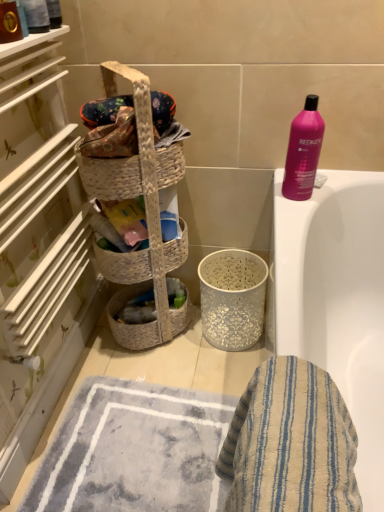
Describe the element at coordinates (146, 218) in the screenshot. I see `woven beige laundry basket at left` at that location.

Locate an element on the screen. blue striped cloth at lower right is located at coordinates (290, 443).

Measure the distance between point (154,161) and camera.

The depth of point (154,161) is 3.71 feet.

You are a GUI agent. You are given a task and a screenshot of the screen. Output one action in this format:
    pyautogui.click(x=<x>, y=<y>)
    Task: Click on the woven basket at left
    The height and width of the screenshot is (512, 384).
    Given the screenshot: What is the action you would take?
    pyautogui.click(x=39, y=249)

Where is `woven beige laundry basket at left`? woven beige laundry basket at left is located at coordinates (146, 218).

From their relative heights in the image, would you say woven basket at left is taller or shorter than gray textured bath mat at lower center?

woven basket at left is taller than gray textured bath mat at lower center.

From the image's perspective, which is above, woven basket at left or gray textured bath mat at lower center?

woven basket at left.

At what (x,y) coordinates should I click in order to perform the action: click on shelf lying above the gray textured bath mat at lower center (from the image's perspective). Please return your answer as a coordinate pair (x, y). Looking at the image, I should click on pyautogui.click(x=39, y=249).

From a real-world perspective, which object stands above the other?

From a 3D spatial view, woven basket at left is above.

Is point (114, 457) positioned in front of point (81, 341)?

Yes, point (114, 457) is in front of point (81, 341).

This screenshot has width=384, height=512. I want to click on shelf that appears in front of the gray textured bath mat at lower center, so click(x=39, y=249).

How different are the orientations of gray textured bath mat at lower center and woven basket at left in degrees?

The angle between the facing direction of gray textured bath mat at lower center and the facing direction of woven basket at left is 90.5 degrees.

Can you confirm if woven natural picnic basket at center is shorter than gray textured bath mat at lower center?

In fact, woven natural picnic basket at center may be taller than gray textured bath mat at lower center.

From the image's perspective, is woven natural picnic basket at center located above or below gray textured bath mat at lower center?

From the image's perspective, woven natural picnic basket at center appears above gray textured bath mat at lower center.

In the image, there is a woven natural picnic basket at center. At what (x,y) coordinates should I click in order to perform the action: click on bath mat below it (from the image's perspective). Please return your answer as a coordinate pair (x, y). The image size is (384, 512). Looking at the image, I should click on (135, 451).

Between woven natural picnic basket at center and gray textured bath mat at lower center, which one has larger width?

gray textured bath mat at lower center.

In terms of size, does pink glossy shampoo at upper right appear bigger or smaller than woven basket at left?

Clearly, pink glossy shampoo at upper right is smaller in size than woven basket at left.

Is pink glossy shampoo at upper right placed right next to woven basket at left?

pink glossy shampoo at upper right and woven basket at left are clearly separated.

Is pink glossy shampoo at upper right completely or partially outside of woven basket at left?

Yes, pink glossy shampoo at upper right is located beyond the bounds of woven basket at left.

Are woven beige laundry basket at left and gray textured bath mat at lower center located far from each other?

Actually, woven beige laundry basket at left and gray textured bath mat at lower center are a little close together.

Is woven beige laundry basket at left bigger than gray textured bath mat at lower center?

Indeed, woven beige laundry basket at left has a larger size compared to gray textured bath mat at lower center.

Would you say gray textured bath mat at lower center is part of woven beige laundry basket at left's contents?

No, gray textured bath mat at lower center is located outside of woven beige laundry basket at left.

Is point (150, 126) positioned after point (108, 471)?

No, (150, 126) is closer to viewer.

Is gray textured bath mat at lower center far away from pink glossy shampoo at upper right?

No.

Considering the relative sizes of gray textured bath mat at lower center and pink glossy shampoo at upper right in the image provided, is gray textured bath mat at lower center thinner than pink glossy shampoo at upper right?

No, gray textured bath mat at lower center is not thinner than pink glossy shampoo at upper right.

Is gray textured bath mat at lower center facing away from pink glossy shampoo at upper right?

No, pink glossy shampoo at upper right is not at the back of gray textured bath mat at lower center.

Are woven beige laundry basket at left and blue striped cloth at lower right located far from each other?

No.

Is woven beige laundry basket at left positioned in front of blue striped cloth at lower right?

No, it is behind blue striped cloth at lower right.

Where is `laundry basket behind the blue striped cloth at lower right`? This screenshot has width=384, height=512. laundry basket behind the blue striped cloth at lower right is located at coordinates (146, 218).

I want to click on bath mat located behind the woven basket at left, so click(135, 451).

Where is `shelf to the left of gray textured bath mat at lower center`? This screenshot has height=512, width=384. shelf to the left of gray textured bath mat at lower center is located at coordinates (39, 249).

Estimate the real-world distances between objects in this image. Which object is closer to gray textured bath mat at lower center, woven basket at left or blue striped cloth at lower right?

woven basket at left is positioned closer to the anchor gray textured bath mat at lower center.

Which object lies nearer to the anchor point woven natural picnic basket at center, gray textured bath mat at lower center or blue striped cloth at lower right?

gray textured bath mat at lower center lies closer to woven natural picnic basket at center than the other object.

When comparing their distances from gray textured bath mat at lower center, does pink glossy shampoo at upper right or woven beige laundry basket at left seem closer?

woven beige laundry basket at left is closer to gray textured bath mat at lower center.

Based on their spatial positions, is blue striped cloth at lower right or woven basket at left further from woven beige laundry basket at left?

Based on the image, blue striped cloth at lower right appears to be further to woven beige laundry basket at left.

From the image, which object appears to be farther from woven basket at left, woven beige laundry basket at left or pink glossy shampoo at upper right?

pink glossy shampoo at upper right.

When comparing their distances from woven basket at left, does woven natural picnic basket at center or blue striped cloth at lower right seem further?

blue striped cloth at lower right.

Estimate the real-world distances between objects in this image. Which object is closer to woven natural picnic basket at center, pink glossy shampoo at upper right or woven basket at left?

Based on the image, woven basket at left appears to be nearer to woven natural picnic basket at center.

Considering their positions, is woven beige laundry basket at left positioned closer to woven natural picnic basket at center than pink glossy shampoo at upper right?

The object closer to woven natural picnic basket at center is woven beige laundry basket at left.

This screenshot has height=512, width=384. I want to click on laundry basket between woven basket at left and pink glossy shampoo at upper right in the horizontal direction, so click(146, 218).

Where is `bottle that lies between woven natural picnic basket at center and blue striped cloth at lower right from top to bottom`? The image size is (384, 512). bottle that lies between woven natural picnic basket at center and blue striped cloth at lower right from top to bottom is located at coordinates (x=303, y=151).

You are a GUI agent. You are given a task and a screenshot of the screen. Output one action in this format:
    pyautogui.click(x=<x>, y=<y>)
    Task: Click on the bath towel between woven beige laundry basket at left and gray textured bath mat at lower center in the up-down direction
    The image size is (384, 512).
    Given the screenshot: What is the action you would take?
    pyautogui.click(x=290, y=443)

What are the coordinates of `laundry basket between woven basket at left and gray textured bath mat at lower center vertically` in the screenshot? It's located at (146, 218).